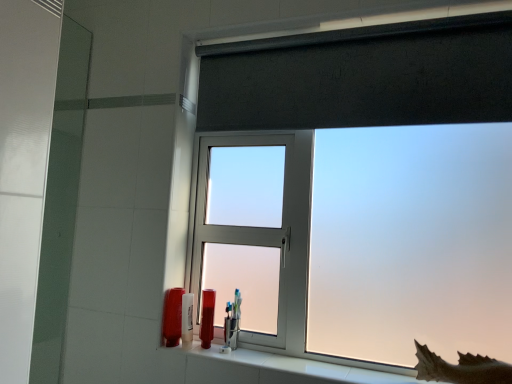
The height and width of the screenshot is (384, 512). What are the coordinates of `free space in front of translucent plastic tube at lower center, marked as the second toiletry in a right-to-left arrangement` in the screenshot? It's located at (214, 347).